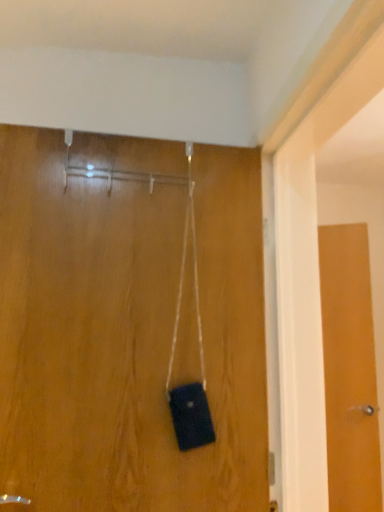
The width and height of the screenshot is (384, 512). Describe the element at coordinates (349, 370) in the screenshot. I see `wooden door at right, the 2th door from the front` at that location.

Locate an element on the screen. The width and height of the screenshot is (384, 512). wooden door at right, the 2th door from the left is located at coordinates (349, 370).

Describe the element at coordinates (126, 333) in the screenshot. The height and width of the screenshot is (512, 384). I see `matte wood door at center, positioned as the first door in left-to-right order` at that location.

Where is `matte wood door at center, positioned as the first door in left-to-right order`? This screenshot has width=384, height=512. matte wood door at center, positioned as the first door in left-to-right order is located at coordinates click(126, 333).

What is the approximate width of matte wood door at center, which is the first door from front to back?

The width of matte wood door at center, which is the first door from front to back, is 4.42 inches.

This screenshot has height=512, width=384. What are the coordinates of `wooden door at right, which appears as the first door when viewed from the back` in the screenshot? It's located at (349, 370).

In the scene shown: Is matte wood door at center, acting as the second door starting from the back, to the right of wooden door at right, the 1th door positioned from the right, from the viewer's perspective?

Incorrect, matte wood door at center, acting as the second door starting from the back, is not on the right side of wooden door at right, the 1th door positioned from the right.

Relative to wooden door at right, which appears as the first door when viewed from the back, is matte wood door at center, which is the first door from front to back, in front or behind?

matte wood door at center, which is the first door from front to back, is positioned closer to the viewer than wooden door at right, which appears as the first door when viewed from the back.

Which is behind, point (53, 215) or point (374, 426)?

The point (374, 426) is behind.

From the image's perspective, relative to wooden door at right, the 2th door from the front, is matte wood door at center, which is the second door in right-to-left order, above or below?

From the image's perspective, matte wood door at center, which is the second door in right-to-left order, appears above wooden door at right, the 2th door from the front.

From a real-world perspective, which is physically below, matte wood door at center, which is the first door from front to back, or wooden door at right, the 1th door positioned from the right?

wooden door at right, the 1th door positioned from the right, is physically lower.

Which object is wider, matte wood door at center, positioned as the first door in left-to-right order, or wooden door at right, the 2th door from the front?

Wider between the two is matte wood door at center, positioned as the first door in left-to-right order.

In the scene shown: Considering the sizes of matte wood door at center, acting as the second door starting from the back, and wooden door at right, the 1th door positioned from the right, in the image, is matte wood door at center, acting as the second door starting from the back, taller or shorter than wooden door at right, the 1th door positioned from the right,?

In the image, matte wood door at center, acting as the second door starting from the back, appears to be shorter than wooden door at right, the 1th door positioned from the right.

Considering the relative sizes of matte wood door at center, positioned as the first door in left-to-right order, and wooden door at right, the 1th door positioned from the right, in the image provided, is matte wood door at center, positioned as the first door in left-to-right order, smaller than wooden door at right, the 1th door positioned from the right,?

Actually, matte wood door at center, positioned as the first door in left-to-right order, might be larger than wooden door at right, the 1th door positioned from the right.

Is matte wood door at center, which is the first door from front to back, positioned beyond the bounds of wooden door at right, the 2th door from the left?

Yes, matte wood door at center, which is the first door from front to back, is located beyond the bounds of wooden door at right, the 2th door from the left.

Looking at this image, is matte wood door at center, positioned as the first door in left-to-right order, placed right next to wooden door at right, the 2th door from the left?

No, matte wood door at center, positioned as the first door in left-to-right order, is not next to wooden door at right, the 2th door from the left.

Is matte wood door at center, acting as the second door starting from the back, positioned with its back to wooden door at right, which appears as the first door when viewed from the back?

No, wooden door at right, which appears as the first door when viewed from the back, is not at the back of matte wood door at center, acting as the second door starting from the back.

In the scene shown: What's the angular difference between matte wood door at center, which is the first door from front to back, and wooden door at right, the 2th door from the left,'s facing directions?

The angular difference between matte wood door at center, which is the first door from front to back, and wooden door at right, the 2th door from the left, is 40.4 degrees.

Locate an element on the screen. This screenshot has height=512, width=384. door above the wooden door at right, the 2th door from the left (from the image's perspective) is located at coordinates (126, 333).

Which is more to the left, wooden door at right, the 1th door positioned from the right, or matte wood door at center, which is the first door from front to back?

matte wood door at center, which is the first door from front to back, is more to the left.

Is wooden door at right, which appears as the first door when viewed from the back, closer to camera compared to matte wood door at center, which is the first door from front to back?

No, the depth of wooden door at right, which appears as the first door when viewed from the back, is greater than that of matte wood door at center, which is the first door from front to back.

Considering the positions of point (339, 228) and point (88, 422), is point (339, 228) closer or farther from the camera than point (88, 422)?

Clearly, point (339, 228) is more distant from the camera than point (88, 422).

From the image's perspective, is wooden door at right, the 2th door from the left, above or below matte wood door at center, positioned as the first door in left-to-right order?

wooden door at right, the 2th door from the left, is below matte wood door at center, positioned as the first door in left-to-right order.

From a real-world perspective, is wooden door at right, the 2th door from the left, below matte wood door at center, which is the second door in right-to-left order?

Correct, in the physical world, wooden door at right, the 2th door from the left, is lower than matte wood door at center, which is the second door in right-to-left order.

Is wooden door at right, which appears as the first door when viewed from the back, thinner than matte wood door at center, which is the first door from front to back?

Yes.

Who is taller, wooden door at right, the 2th door from the left, or matte wood door at center, which is the first door from front to back?

wooden door at right, the 2th door from the left.

In the scene shown: Can you confirm if wooden door at right, the 1th door positioned from the right, is bigger than matte wood door at center, which is the first door from front to back?

No, wooden door at right, the 1th door positioned from the right, is not bigger than matte wood door at center, which is the first door from front to back.

Is wooden door at right, the 2th door from the left, situated inside matte wood door at center, which is the first door from front to back, or outside?

wooden door at right, the 2th door from the left, is outside matte wood door at center, which is the first door from front to back.

Looking at this image, is wooden door at right, the 2th door from the front, placed right next to matte wood door at center, positioned as the first door in left-to-right order?

wooden door at right, the 2th door from the front, and matte wood door at center, positioned as the first door in left-to-right order, are not in contact.

Is wooden door at right, the 2th door from the front, oriented away from matte wood door at center, which is the first door from front to back?

wooden door at right, the 2th door from the front, is not turned away from matte wood door at center, which is the first door from front to back.

What's the angular difference between wooden door at right, the 2th door from the left, and matte wood door at center, positioned as the first door in left-to-right order,'s facing directions?

40.4 degrees.

How distant is wooden door at right, the 2th door from the front, from matte wood door at center, which is the first door from front to back?

wooden door at right, the 2th door from the front, is 4.55 feet away from matte wood door at center, which is the first door from front to back.

At what (x,y) coordinates should I click in order to perform the action: click on door behind the matte wood door at center, which is the first door from front to back. Please return your answer as a coordinate pair (x, y). Looking at the image, I should click on (349, 370).

Find the location of a particular element. door in front of the wooden door at right, the 2th door from the front is located at coordinates (126, 333).

Locate an element on the screen. door on the right side of matte wood door at center, which is the first door from front to back is located at coordinates (349, 370).